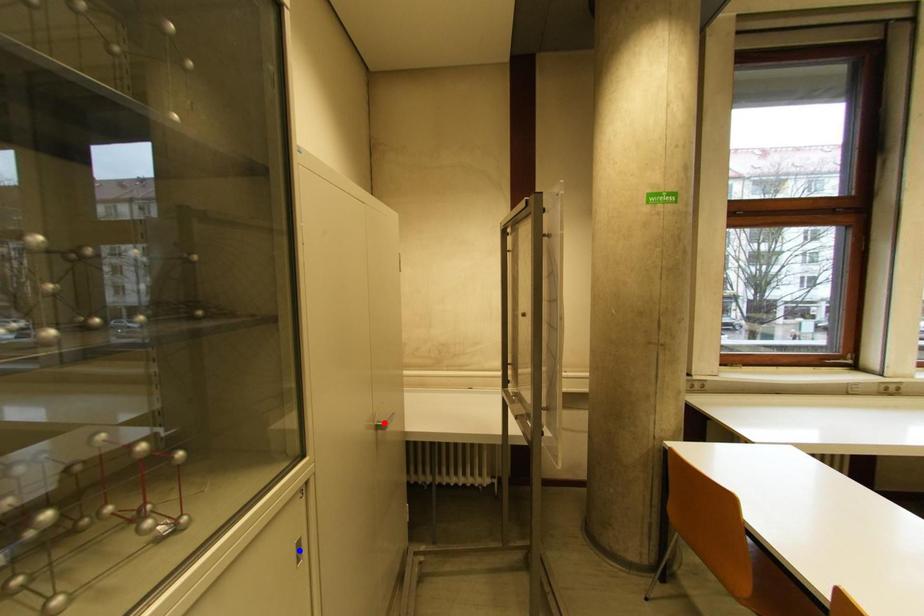
Question: In the image, two points are highlighted. Which point is nearer to the camera? Reply with the corresponding letter.

Choices:
 (A) blue point
 (B) red point

Answer: (A)